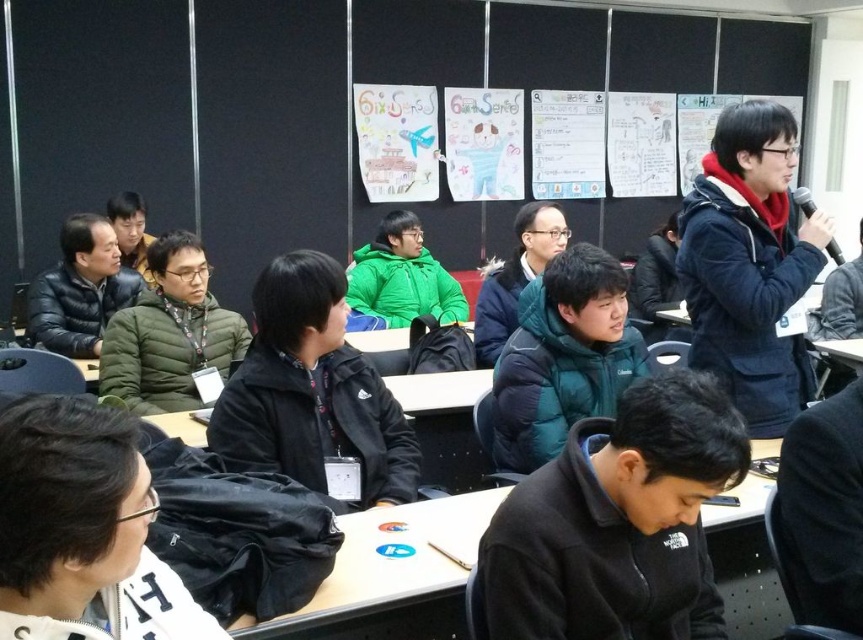
Question: Is green down jacket at center to the right of green matte jacket at center from the viewer's perspective?

Choices:
 (A) yes
 (B) no

Answer: (B)

Question: Which point is closer to the camera?

Choices:
 (A) blue denim jacket at upper right
 (B) green matte jacket at center
 (C) teal down jacket at center

Answer: (C)

Question: Which point is farther to the camera?

Choices:
 (A) (441, 324)
 (B) (419, 529)

Answer: (A)

Question: Which object is farther from the camera taking this photo?

Choices:
 (A) black fleece jacket at center
 (B) white plastic table at center
 (C) green matte jacket at center
 (D) green down jacket at center

Answer: (C)

Question: Is black fuzzy jacket at upper left positioned at the back of matte black jacket at center?

Choices:
 (A) no
 (B) yes

Answer: (B)

Question: Can you confirm if white fleece jacket at lower left is positioned to the left of black matte jacket at center?

Choices:
 (A) no
 (B) yes

Answer: (B)